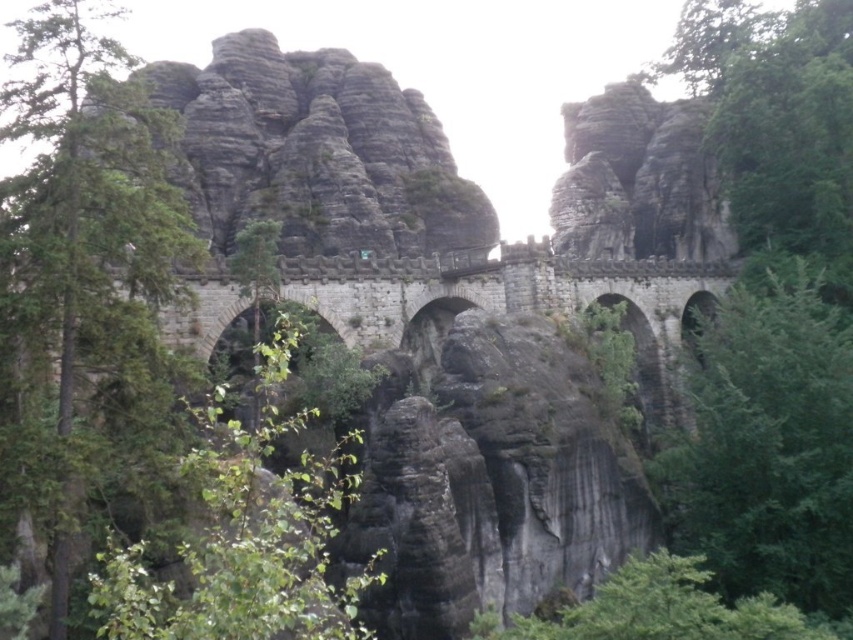
Question: Is green leafy tree at right to the left of green leafy tree at lower center from the viewer's perspective?

Choices:
 (A) no
 (B) yes

Answer: (A)

Question: Does green leafy tree at left appear under green leafy tree at right?

Choices:
 (A) yes
 (B) no

Answer: (B)

Question: In this image, where is green leafy tree at left located relative to rugged stone mountain at center?

Choices:
 (A) left
 (B) right

Answer: (A)

Question: Which of the following is the closest to the observer?

Choices:
 (A) green leafy tree at right
 (B) rugged stone mountain at center

Answer: (B)

Question: Which of the following is the closest to the observer?

Choices:
 (A) green leafy tree at left
 (B) green leafy tree at lower center
 (C) rugged stone mountain at center

Answer: (A)

Question: Which of the following is the farthest from the observer?

Choices:
 (A) rugged stone mountain at center
 (B) green leafy tree at right
 (C) green leafy tree at lower center

Answer: (B)